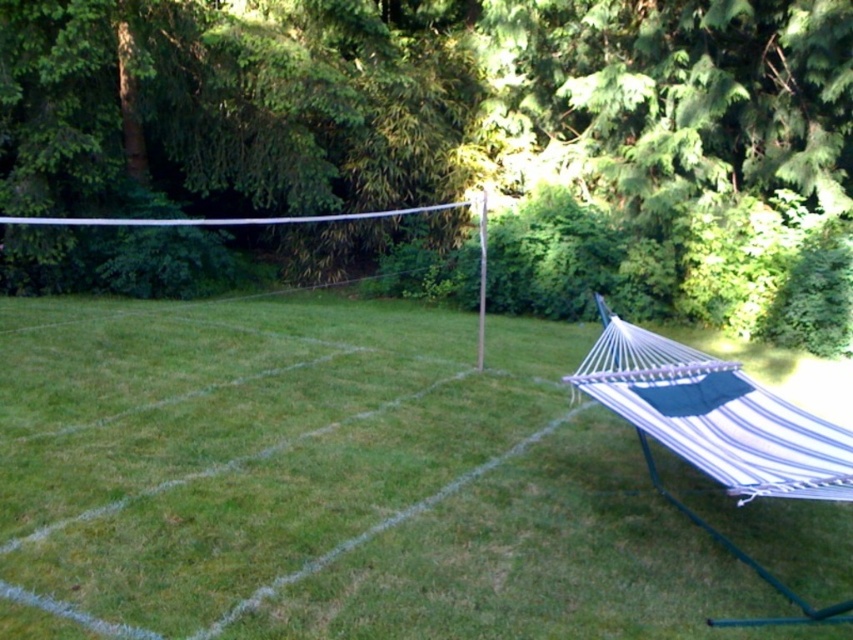
Question: Does green grass at center lie in front of white striped fabric hammock at right?

Choices:
 (A) yes
 (B) no

Answer: (A)

Question: Which point is farther to the camera?

Choices:
 (A) green grass at center
 (B) white striped fabric hammock at right

Answer: (B)

Question: Is green grass at center bigger than white striped fabric hammock at right?

Choices:
 (A) no
 (B) yes

Answer: (B)

Question: Does green leafy tree at upper center appear over white striped fabric hammock at right?

Choices:
 (A) no
 (B) yes

Answer: (B)

Question: Which point is closer to the camera?

Choices:
 (A) (561, 106)
 (B) (798, 484)
 (C) (105, 499)

Answer: (B)

Question: Which point is farther from the camera taking this photo?

Choices:
 (A) (128, 371)
 (B) (693, 122)
 (C) (743, 380)

Answer: (B)